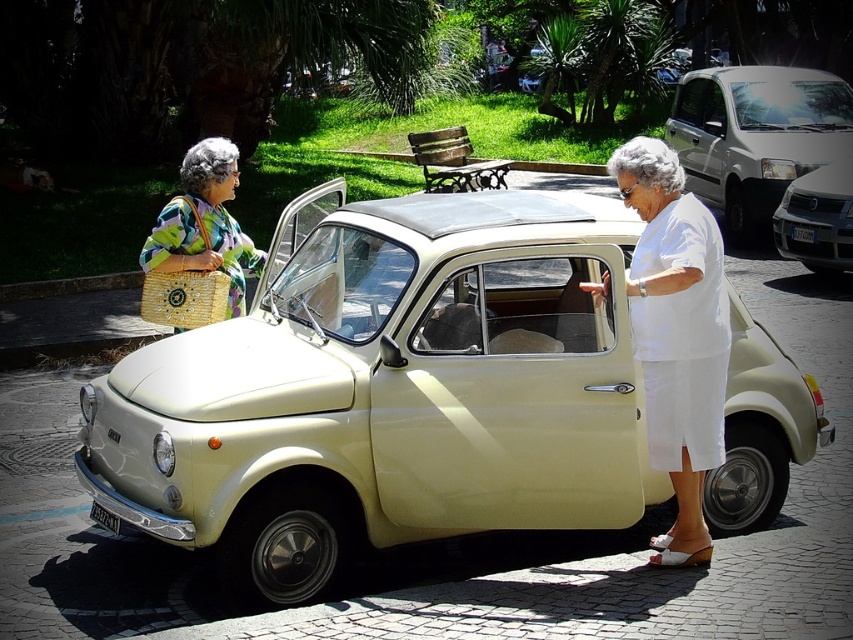
Is the position of matte cream car at center less distant than that of white matte van at center?

Yes, it is.

Is matte cream car at center positioned at the back of white matte van at center?

No, it is not.

Is point (496, 320) closer to viewer compared to point (762, 147)?

Yes, it is in front of point (762, 147).

Where is `matte cream car at center`? The image size is (853, 640). matte cream car at center is located at coordinates tap(386, 392).

Can you confirm if white cotton dress at center is shorter than white matte van at center?

Correct, white cotton dress at center is not as tall as white matte van at center.

What are the coordinates of `white cotton dress at center` in the screenshot? It's located at (676, 333).

Between point (96, 380) and point (779, 212), which one is positioned in front?

Point (96, 380)

This screenshot has width=853, height=640. Find the location of `matte cream car at center`. matte cream car at center is located at coordinates (386, 392).